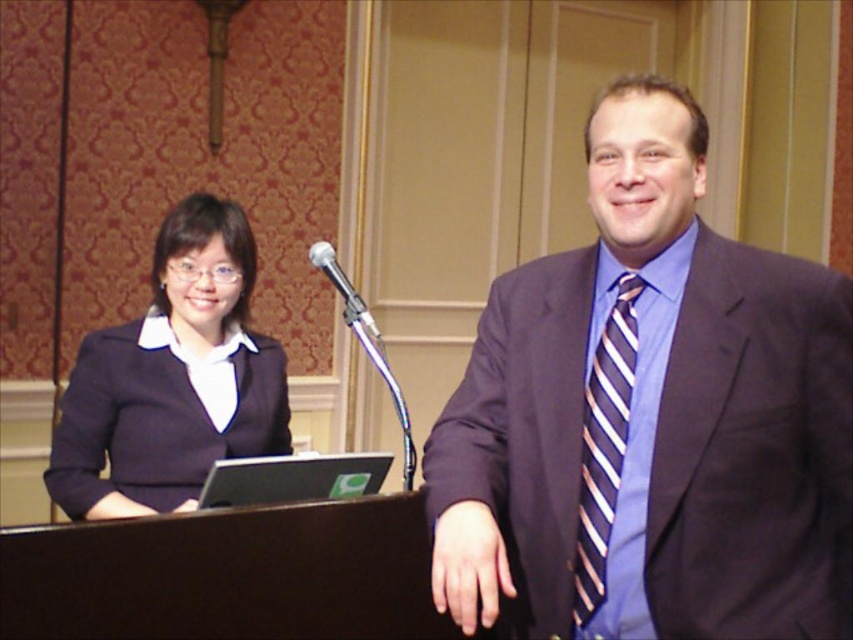
Question: Is black plastic laptop at center below metallic silver microphone at center?

Choices:
 (A) yes
 (B) no

Answer: (A)

Question: Observing the image, what is the correct spatial positioning of dark purple suit at right in reference to metallic silver microphone at center?

Choices:
 (A) above
 (B) below

Answer: (B)

Question: Among these objects, which one is nearest to the camera?

Choices:
 (A) matte black blazer at left
 (B) black plastic laptop at center
 (C) dark purple suit at right

Answer: (C)

Question: Which of the following is the farthest from the observer?

Choices:
 (A) (379, 452)
 (B) (697, 390)

Answer: (A)

Question: Can you confirm if matte black blazer at left is positioned above striped silk tie at right?

Choices:
 (A) yes
 (B) no

Answer: (A)

Question: Estimate the real-world distances between objects in this image. Which object is closer to the striped silk tie at right?

Choices:
 (A) black plastic laptop at center
 (B) dark purple suit at right

Answer: (B)